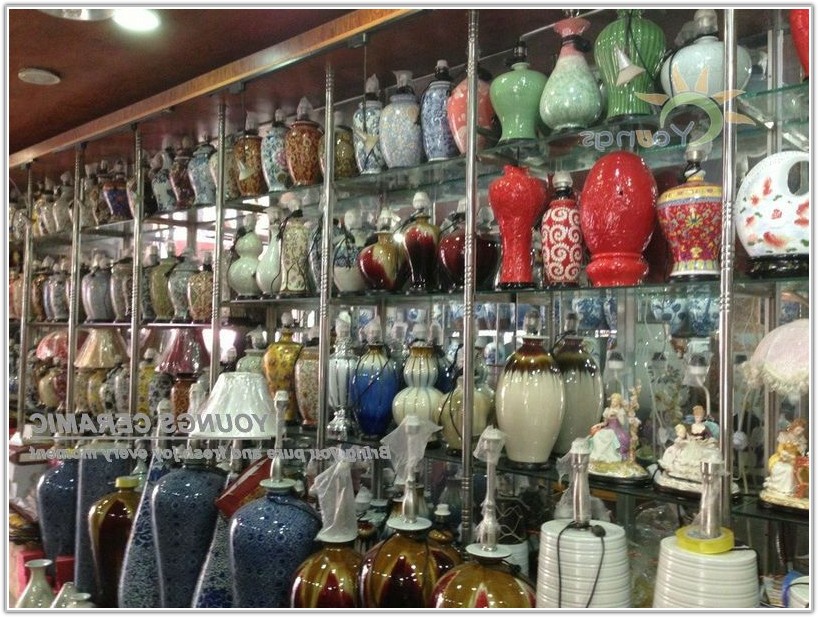
At what (x,y) coordinates should I click in order to perform the action: click on glass shelves. Please return your answer as a coordinate pair (x, y). This screenshot has width=818, height=617. Looking at the image, I should click on (438, 168), (541, 303), (185, 230).